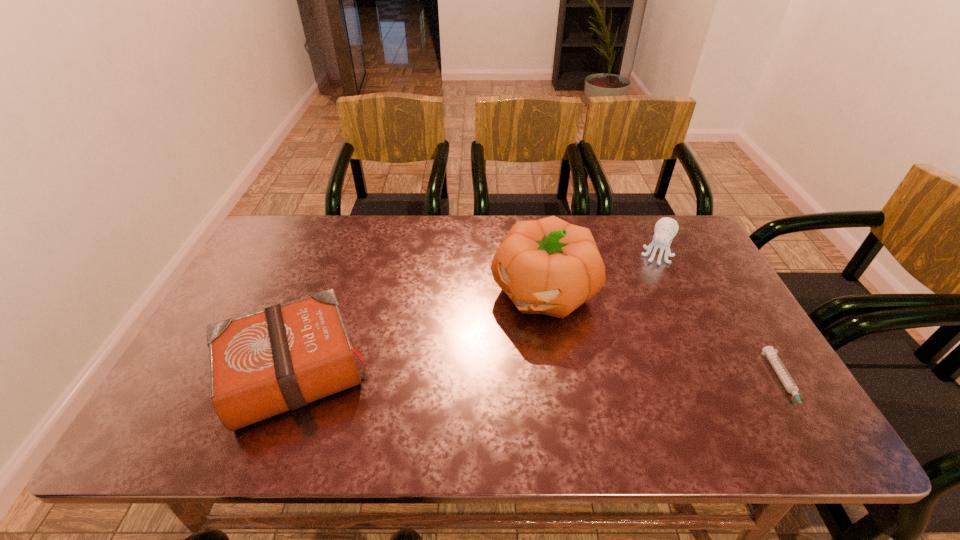
In order to click on free space between the rightmost object and the Bible in this screenshot , I will do `click(539, 379)`.

You are a GUI agent. You are given a task and a screenshot of the screen. Output one action in this format:
    pyautogui.click(x=<x>, y=<y>)
    Task: Click on the free point between the tallest object and the leftmost object
    The width and height of the screenshot is (960, 540).
    Given the screenshot: What is the action you would take?
    pyautogui.click(x=418, y=332)

Locate an element on the screen. This screenshot has height=540, width=960. free spot between the leftmost object and the octopus is located at coordinates (474, 314).

Where is `free space between the leftmost object and the third object from right to left`? free space between the leftmost object and the third object from right to left is located at coordinates (418, 332).

This screenshot has width=960, height=540. I want to click on empty location between the shortest object and the third object from left to right, so click(x=720, y=320).

Identify the location of blank region between the octopus and the leftmost object. Image resolution: width=960 pixels, height=540 pixels. (474, 314).

You are a GUI agent. You are given a task and a screenshot of the screen. Output one action in this format:
    pyautogui.click(x=<x>, y=<y>)
    Task: Click on the object that stands as the second closest to the syringe
    The width and height of the screenshot is (960, 540).
    Given the screenshot: What is the action you would take?
    pyautogui.click(x=548, y=266)

Where is `the second closest object to the pumpkin`? the second closest object to the pumpkin is located at coordinates (262, 364).